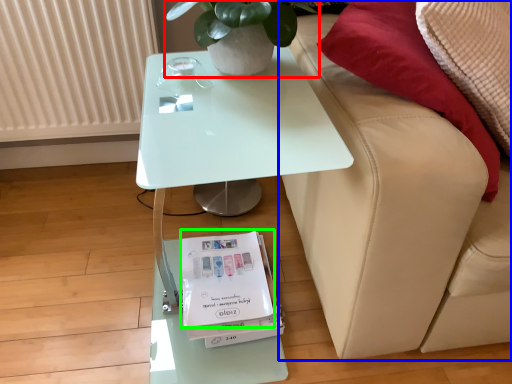
Question: Considering the real-world distances, which object is closest to houseplant (highlighted by a red box)? studio couch (highlighted by a blue box) or magazine (highlighted by a green box).

Choices:
 (A) studio couch
 (B) magazine

Answer: (A)